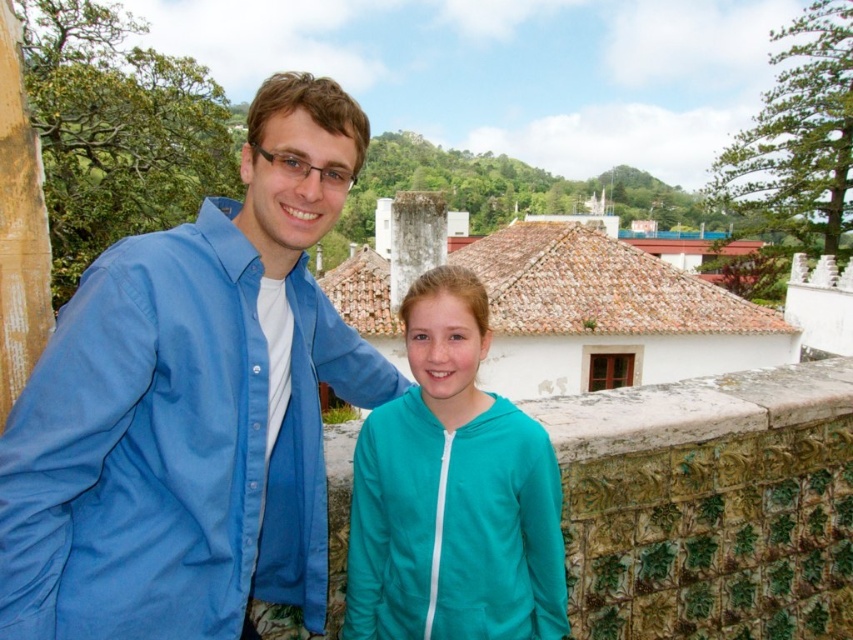
Question: Does blue cotton shirt at left come in front of teal fleece jacket at center?

Choices:
 (A) yes
 (B) no

Answer: (A)

Question: Is blue cotton shirt at left closer to the viewer compared to teal fleece jacket at center?

Choices:
 (A) yes
 (B) no

Answer: (A)

Question: Which point appears closest to the camera in this image?

Choices:
 (A) (195, 292)
 (B) (485, 532)

Answer: (A)

Question: Which object is closer to the camera taking this photo?

Choices:
 (A) blue cotton shirt at left
 (B) teal fleece jacket at center

Answer: (A)

Question: Which point appears closest to the camera in this image?

Choices:
 (A) (352, 580)
 (B) (299, 97)

Answer: (B)

Question: Can you confirm if blue cotton shirt at left is positioned to the left of teal fleece jacket at center?

Choices:
 (A) yes
 (B) no

Answer: (A)